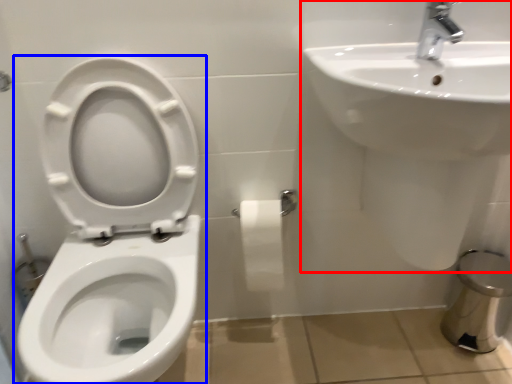
Question: Which point is further to the camera, sink (highlighted by a red box) or toilet (highlighted by a blue box)?

Choices:
 (A) sink
 (B) toilet

Answer: (A)